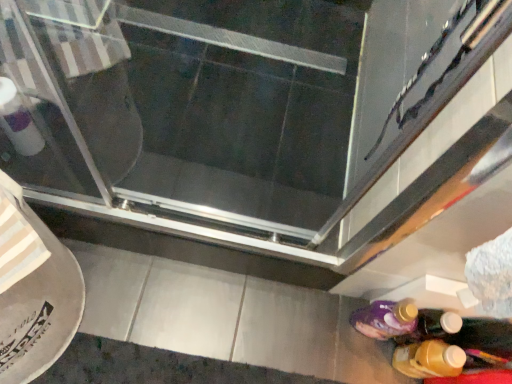
Question: Considering the positions of transparent glass screen door at center and translucent plastic bottle at lower right in the image, is transparent glass screen door at center wider or thinner than translucent plastic bottle at lower right?

Choices:
 (A) wide
 (B) thin

Answer: (A)

Question: Considering the positions of point (303, 26) and point (423, 370), is point (303, 26) closer or farther from the camera than point (423, 370)?

Choices:
 (A) farther
 (B) closer

Answer: (A)

Question: In the image, is transparent glass screen door at center positioned in front of or behind translucent plastic bottle at lower right?

Choices:
 (A) behind
 (B) front

Answer: (A)

Question: From their relative heights in the image, would you say translucent plastic bottle at lower right is taller or shorter than transparent glass screen door at center?

Choices:
 (A) tall
 (B) short

Answer: (A)

Question: Looking at their shapes, would you say translucent plastic bottle at lower right is wider or thinner than transparent glass screen door at center?

Choices:
 (A) thin
 (B) wide

Answer: (A)

Question: Looking at the image, does translucent plastic bottle at lower right seem bigger or smaller compared to transparent glass screen door at center?

Choices:
 (A) small
 (B) big

Answer: (A)

Question: From the image's perspective, relative to transparent glass screen door at center, is translucent plastic bottle at lower right above or below?

Choices:
 (A) below
 (B) above

Answer: (A)